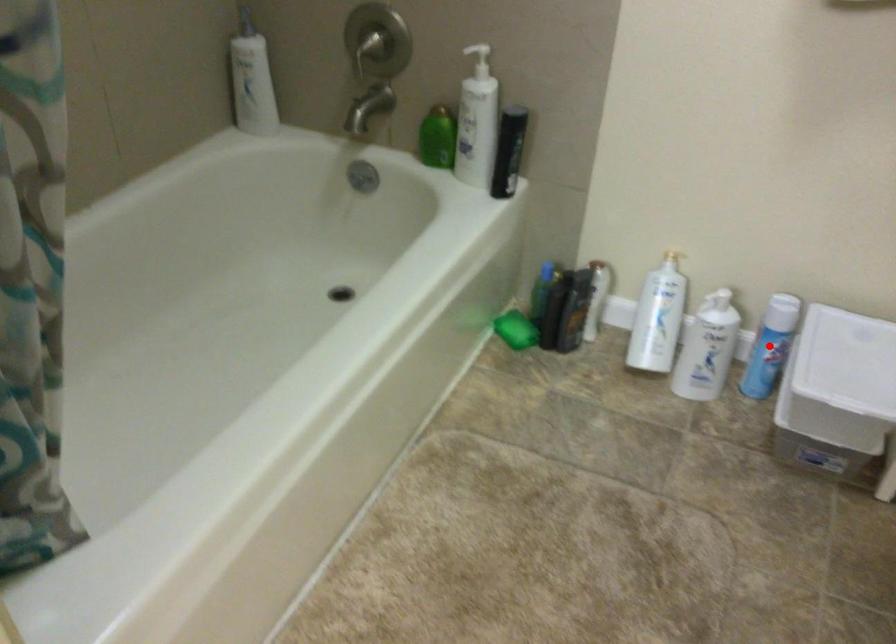
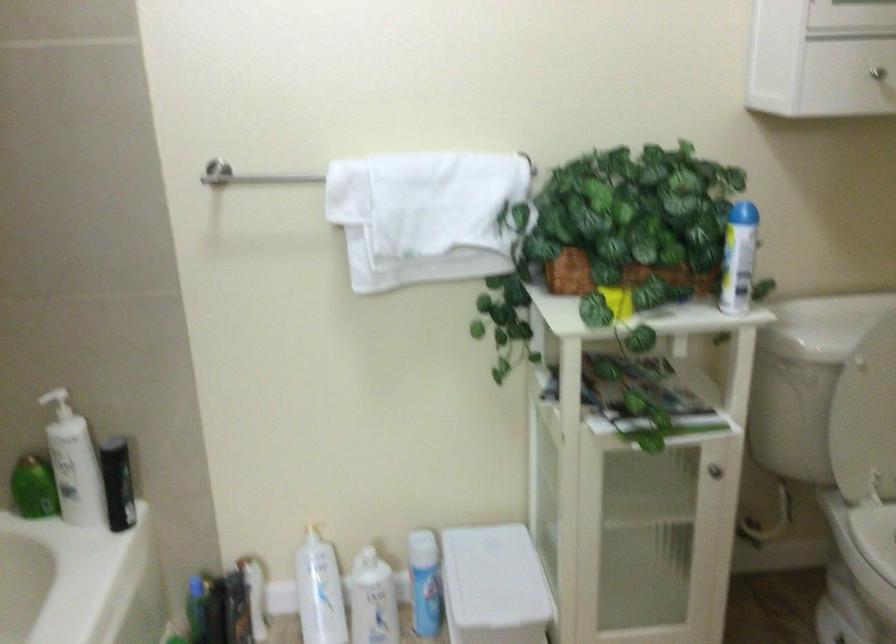
In the second image, find the point that corresponds to the highlighted location in the first image.

(424, 583)